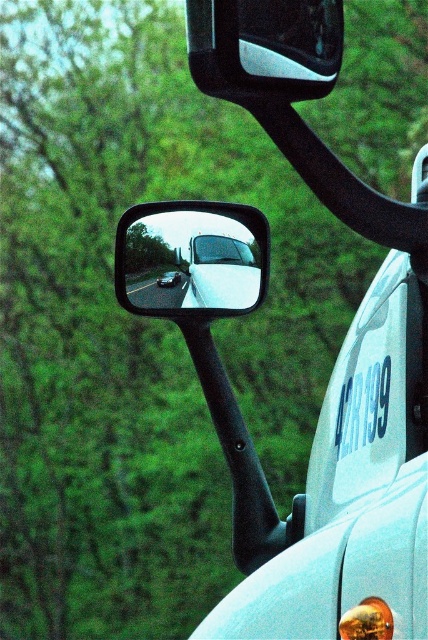
Is clear glass mirror at center below white plastic license plate at center-right?

No, clear glass mirror at center is not below white plastic license plate at center-right.

Can you confirm if clear glass mirror at center is thinner than white plastic license plate at center-right?

No, clear glass mirror at center is not thinner than white plastic license plate at center-right.

Between point (264, 262) and point (344, 385), which one is positioned behind?

Point (264, 262)

Identify the location of clear glass mirror at center. The image size is (428, 640). (192, 259).

Is transparent glass windshield at center thinner than shiny silver sedan at center?

Result: Incorrect, transparent glass windshield at center's width is not less than shiny silver sedan at center's.

Who is lower down, transparent glass windshield at center or shiny silver sedan at center?

Positioned lower is shiny silver sedan at center.

Is point (247, 252) positioned before point (169, 282)?

That is True.

At what (x,y) coordinates should I click in order to perform the action: click on transparent glass windshield at center. Please return your answer as a coordinate pair (x, y). This screenshot has height=640, width=428. Looking at the image, I should click on (220, 250).

How far apart are clear glass mirror at center and matte black mirror at upper center?

clear glass mirror at center is 1.49 meters from matte black mirror at upper center.

Between clear glass mirror at center and matte black mirror at upper center, which one is positioned lower?

clear glass mirror at center

Image resolution: width=428 pixels, height=640 pixels. I want to click on clear glass mirror at center, so click(x=192, y=259).